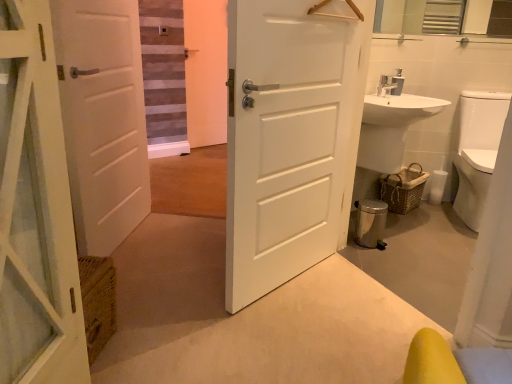
Question: From a real-world perspective, is white matte door at left, acting as the first door starting from the left, located beneath white glossy sink at right?

Choices:
 (A) no
 (B) yes

Answer: (A)

Question: From a real-world perspective, is white matte door at left, acting as the first door starting from the left, on top of white glossy sink at right?

Choices:
 (A) yes
 (B) no

Answer: (A)

Question: Considering the relative sizes of white matte door at left, acting as the first door starting from the left, and white glossy sink at right in the image provided, is white matte door at left, acting as the first door starting from the left, thinner than white glossy sink at right?

Choices:
 (A) yes
 (B) no

Answer: (A)

Question: Is white matte door at left, placed as the second door when sorted from right to left, touching white glossy sink at right?

Choices:
 (A) no
 (B) yes

Answer: (A)

Question: Is white matte door at left, acting as the first door starting from the left, bigger than white glossy sink at right?

Choices:
 (A) no
 (B) yes

Answer: (A)

Question: From the image's perspective, is white glossy toilet bowl at right above or below woven brown basket at lower right?

Choices:
 (A) above
 (B) below

Answer: (A)

Question: Considering their positions, is white glossy toilet bowl at right located in front of or behind woven brown basket at lower right?

Choices:
 (A) front
 (B) behind

Answer: (A)

Question: Is white glossy toilet bowl at right to the left or to the right of woven brown basket at lower right in the image?

Choices:
 (A) right
 (B) left

Answer: (A)

Question: Looking at their shapes, would you say white glossy toilet bowl at right is wider or thinner than woven brown basket at lower right?

Choices:
 (A) wide
 (B) thin

Answer: (A)

Question: From the image's perspective, is woven brown basket at lower right above or below white glossy toilet bowl at right?

Choices:
 (A) below
 (B) above

Answer: (A)

Question: From a real-world perspective, is woven brown basket at lower right positioned above or below white glossy toilet bowl at right?

Choices:
 (A) below
 (B) above

Answer: (A)

Question: In terms of width, does woven brown basket at lower right look wider or thinner when compared to white glossy toilet bowl at right?

Choices:
 (A) wide
 (B) thin

Answer: (B)

Question: Which is correct: woven brown basket at lower right is inside white glossy toilet bowl at right, or outside of it?

Choices:
 (A) outside
 (B) inside

Answer: (A)

Question: Is white glossy sink at right wider or thinner than woven brown basket at lower right?

Choices:
 (A) thin
 (B) wide

Answer: (B)

Question: In the image, is white glossy sink at right positioned in front of or behind woven brown basket at lower right?

Choices:
 (A) front
 (B) behind

Answer: (A)